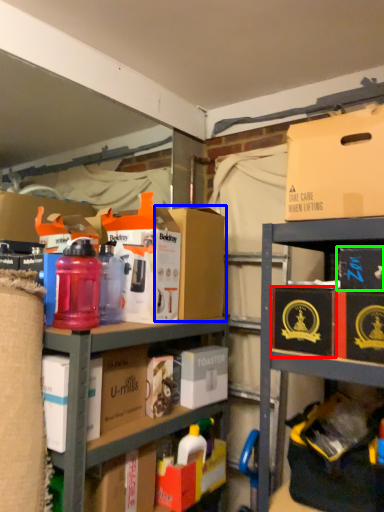
Question: Which object is the farthest from cardboard box (highlighted by a red box)? Choose among these: cardboard box (highlighted by a blue box) or storage box (highlighted by a green box).

Choices:
 (A) cardboard box
 (B) storage box

Answer: (A)